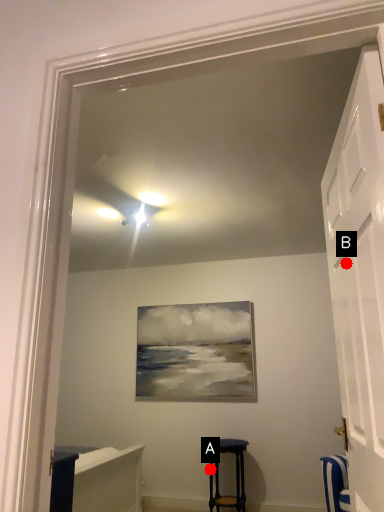
Question: Two points are circled on the image, labeled by A and B beside each circle. Which point is farther from the camera taking this photo?

Choices:
 (A) A is further
 (B) B is further

Answer: (A)